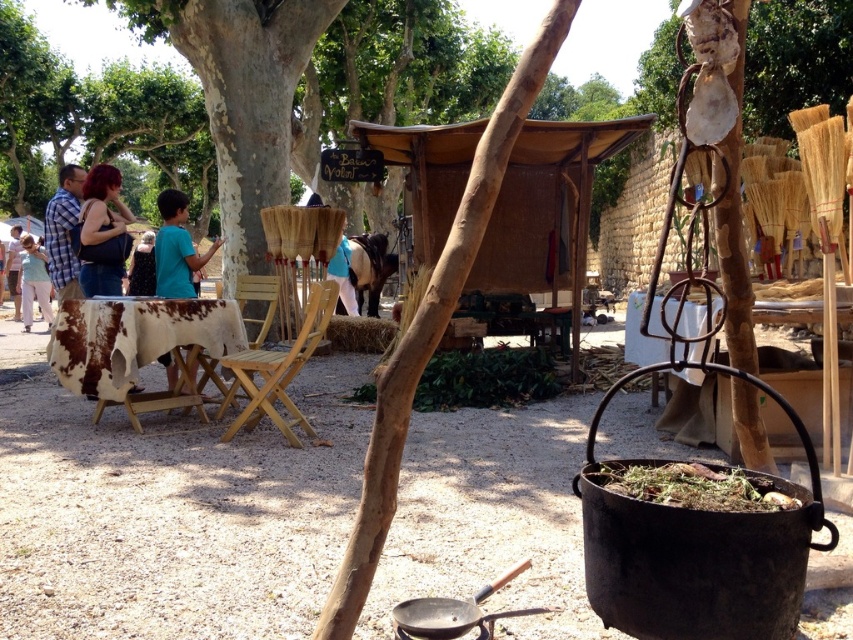
You are a guest at this event and want to sit down. There is a light wood folding chair at center and a black dress at center. Which one is smaller in size?

The light wood folding chair at center has a smaller size compared to the black dress at center, so the light wood folding chair at center is smaller.

You are a guest at this event and want to sit down next to the person wearing the black dress at center. Which direction should you move relative to the light wood folding chair at center to reach them?

The light wood folding chair at center is positioned on the right side of the black dress at center. Therefore, to sit next to the person in the black dress at center, you should move to the left side of the light wood folding chair at center.